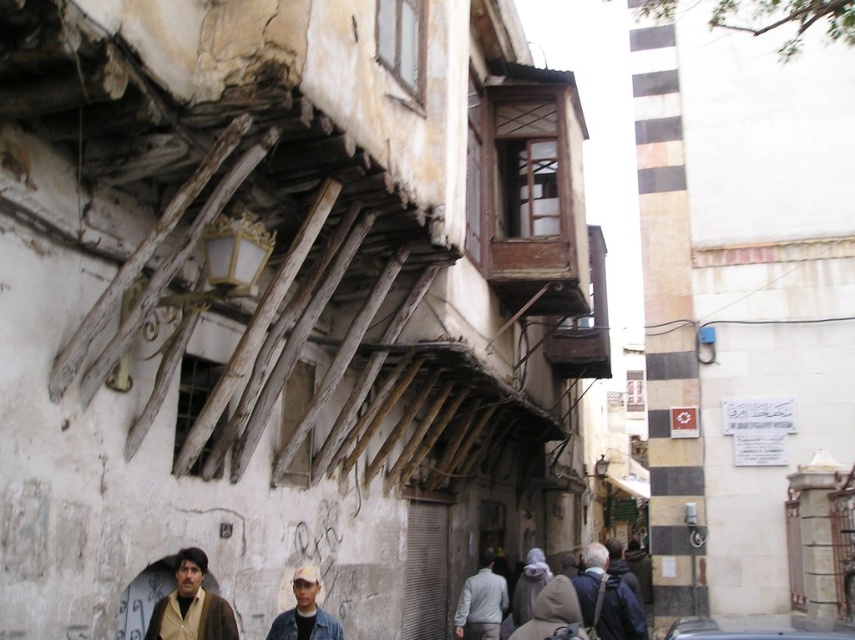
Who is higher up, beige woolen jacket at lower left or metallic silver car at center?

Positioned higher is beige woolen jacket at lower left.

Describe the element at coordinates (192, 605) in the screenshot. The image size is (855, 640). I see `beige woolen jacket at lower left` at that location.

This screenshot has width=855, height=640. Identify the location of beige woolen jacket at lower left. (192, 605).

At what (x,y) coordinates should I click in order to perform the action: click on beige woolen jacket at lower left. Please return your answer as a coordinate pair (x, y). This screenshot has width=855, height=640. Looking at the image, I should click on (192, 605).

Between beige woolen jacket at lower left and denim jacket at lower center, which one has more height?

With more height is beige woolen jacket at lower left.

Identify the location of beige woolen jacket at lower left. (192, 605).

Identify the location of beige woolen jacket at lower left. Image resolution: width=855 pixels, height=640 pixels. (192, 605).

Which is in front, point (605, 621) or point (304, 618)?

Point (304, 618) is more forward.

Can you confirm if dark blue jacket at lower right is thinner than denim jacket at lower center?

Incorrect, dark blue jacket at lower right's width is not less than denim jacket at lower center's.

Which is behind, point (576, 596) or point (308, 573)?

The point (576, 596) is behind.

Where is `dark blue jacket at lower right`? The image size is (855, 640). dark blue jacket at lower right is located at coordinates (606, 598).